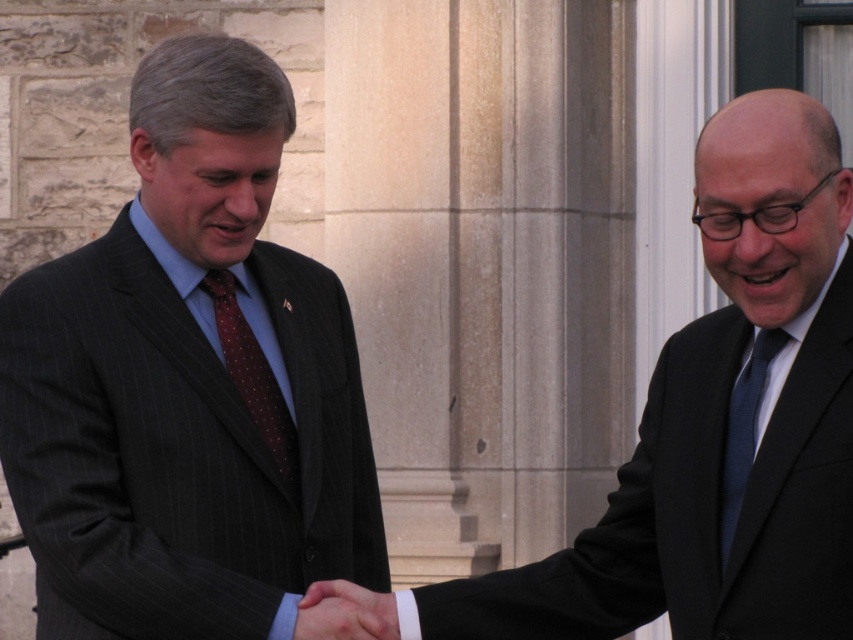
Does dark pinstripe suit at center have a larger size compared to smooth skin handshake at center?

Correct, dark pinstripe suit at center is larger in size than smooth skin handshake at center.

Does dark pinstripe suit at center have a smaller size compared to smooth skin handshake at center?

No, dark pinstripe suit at center is not smaller than smooth skin handshake at center.

You are a GUI agent. You are given a task and a screenshot of the screen. Output one action in this format:
    pyautogui.click(x=<x>, y=<y>)
    Task: Click on the dark pinstripe suit at center
    
    Given the screenshot: What is the action you would take?
    pyautogui.click(x=721, y=426)

Between point (231, 360) and point (730, 452), which one is positioned in front?

Point (730, 452) is more forward.

In the scene shown: Can you confirm if polka dot silk tie at left is taller than dark blue silk tie at right?

Yes, polka dot silk tie at left is taller than dark blue silk tie at right.

Between point (241, 353) and point (735, 516), which one is positioned behind?

Positioned behind is point (241, 353).

Locate an element on the screen. polka dot silk tie at left is located at coordinates (253, 376).

Based on the photo, between dark blue silk tie at right and smooth skin handshake at center, which one has less height?

smooth skin handshake at center is shorter.

Does dark blue silk tie at right lie behind smooth skin handshake at center?

Yes, it is.

Does point (724, 468) lie behind point (317, 602)?

Yes, point (724, 468) is behind point (317, 602).

Identify the location of dark blue silk tie at right. (744, 428).